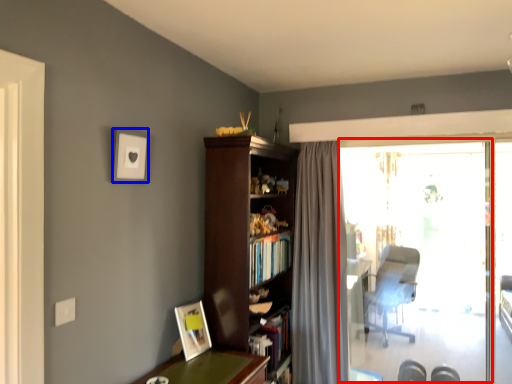
Question: Which object is further to the camera taking this photo, window screen (highlighted by a red box) or picture frame (highlighted by a blue box)?

Choices:
 (A) window screen
 (B) picture frame

Answer: (A)